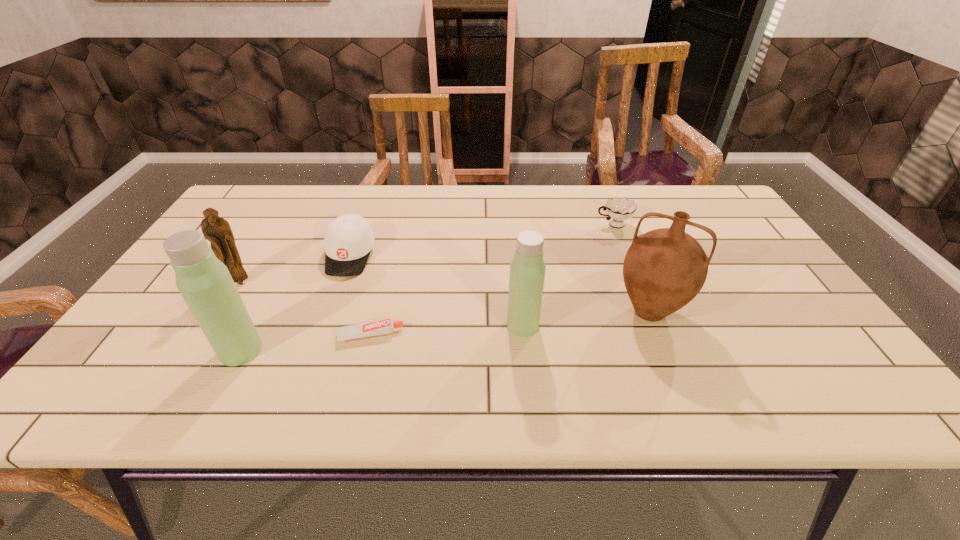
Where is `free spot between the cup and the taller thermos bottle`? The image size is (960, 540). free spot between the cup and the taller thermos bottle is located at coordinates (427, 288).

Identify the location of unoccupied area between the figurine and the toothpaste. (305, 309).

The image size is (960, 540). I want to click on unoccupied position between the pitcher and the taller thermos bottle, so click(445, 331).

Where is `empty location between the baseball cap and the leftmost object`? empty location between the baseball cap and the leftmost object is located at coordinates (295, 269).

This screenshot has width=960, height=540. In order to click on vacant area that lies between the shortest object and the fifth tallest object in this screenshot , I will do `click(360, 295)`.

You are a GUI agent. You are given a task and a screenshot of the screen. Output one action in this format:
    pyautogui.click(x=<x>, y=<y>)
    Task: Click on the vacant area between the cup and the taller thermos bottle
    The width and height of the screenshot is (960, 540).
    Given the screenshot: What is the action you would take?
    pyautogui.click(x=427, y=288)

Identify the location of object that can be found as the closest to the pitcher. (527, 269).

Choose which object is the second nearest neighbor to the shorter thermos bottle. Please provide its 2D coordinates. Your answer should be formatted as a tuple, i.e. [(x, y)], where the tuple contains the x and y coordinates of a point satisfying the conditions above.

[(386, 326)]

Identify the location of vacant position in the image that satisfies the following two spatial constraints: 1. on the front-facing side of the pitcher; 2. on the right side of the fifth tallest object. (329, 312).

This screenshot has width=960, height=540. I want to click on vacant position in the image that satisfies the following two spatial constraints: 1. on the front-facing side of the leftmost object; 2. on the right side of the pitcher, so click(223, 312).